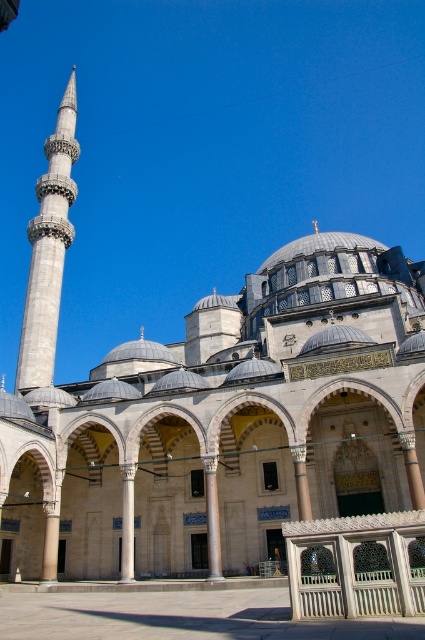
Question: Does gray stone minaret at left have a greater width compared to slate stone column at center?

Choices:
 (A) no
 (B) yes

Answer: (B)

Question: Does slate stone column at center appear on the left side of white marble pillar at center?

Choices:
 (A) no
 (B) yes

Answer: (A)

Question: Is gray stone minaret at left smaller than slate stone column at center?

Choices:
 (A) no
 (B) yes

Answer: (A)

Question: Which object appears closest to the camera in this image?

Choices:
 (A) gray stone minaret at left
 (B) white marble pillar at center
 (C) slate stone column at center

Answer: (C)

Question: Which of the following is the farthest from the observer?

Choices:
 (A) gray stone minaret at left
 (B) white marble pillar at center

Answer: (A)

Question: Which object appears closest to the camera in this image?

Choices:
 (A) gray stone minaret at left
 (B) slate stone column at center

Answer: (B)